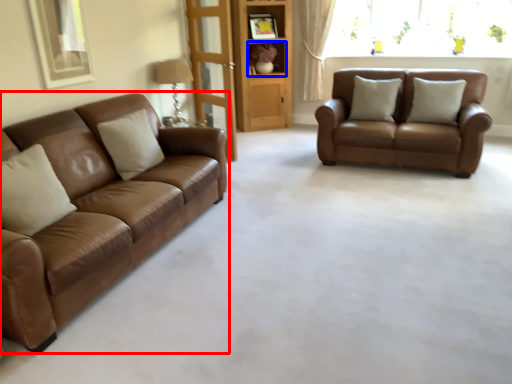
Question: Which object appears farthest to the camera in this image, studio couch (highlighted by a red box) or shelf (highlighted by a blue box)?

Choices:
 (A) studio couch
 (B) shelf

Answer: (B)